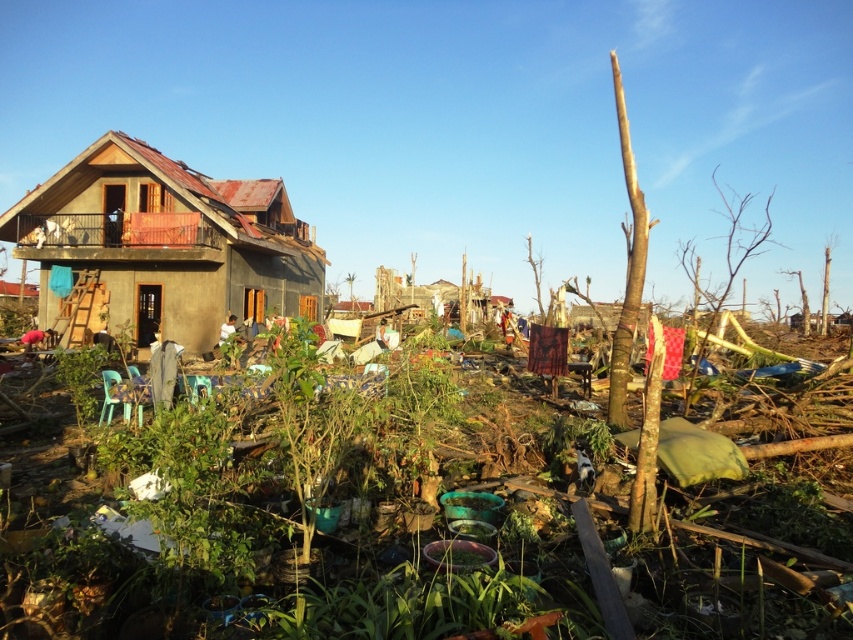
You are a rescue worker assessing the damage after a storm. You notice the brown wooden debris at center and the matte brown house at left. Based on their positions, which object is closer to the right side of the scene?

The brown wooden debris at center is to the right of the matte brown house at left, so it is closer to the right side of the scene.

You are a rescue worker assessing the scene. You notice the brown wooden debris at center and the matte brown house at left. Which object is taller?

The matte brown house at left is taller than the brown wooden debris at center.